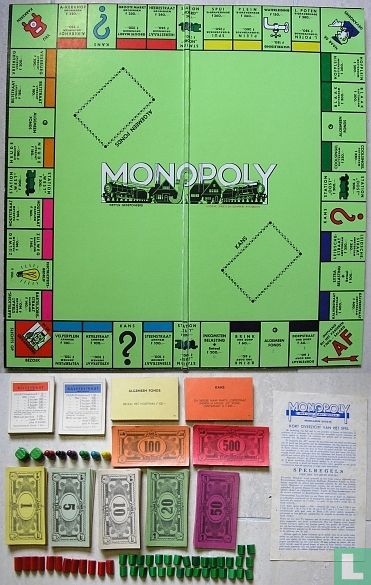
Image resolution: width=371 pixels, height=585 pixels. What are the coordinates of `piles of game cards` in the screenshot? It's located at (35, 397), (77, 398), (137, 398), (222, 392).